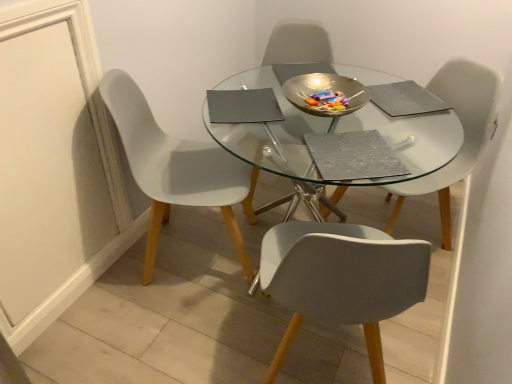
In order to face metallic silver chair at center, marked as the 2th chair in a left-to-right arrangement, should I rotate leftwards or rightwards?

To align with it, rotate right about 4.782°.

At what (x,y) coordinates should I click in order to perform the action: click on metallic silver chair at center, marked as the 2th chair in a left-to-right arrangement. Please return your answer as a coordinate pair (x, y). The width and height of the screenshot is (512, 384). Looking at the image, I should click on tap(298, 44).

This screenshot has width=512, height=384. I want to click on white plastic chair at left, positioned as the first chair in left-to-right order, so click(175, 168).

This screenshot has height=384, width=512. Find the location of `white plastic chair at center, which ranks as the third chair in left-to-right order`. white plastic chair at center, which ranks as the third chair in left-to-right order is located at coordinates (464, 136).

Identify the location of metallic silver chair at center, which is the second chair from right to left. (298, 44).

Would you say white plastic chair at left, positioned as the first chair in left-to-right order, is part of white plastic chair at center, which is the first chair in right-to-left order,'s contents?

No, white plastic chair at left, positioned as the first chair in left-to-right order, is not surrounded by white plastic chair at center, which is the first chair in right-to-left order.

Is white plastic chair at center, which is the first chair in right-to-left order, looking in the opposite direction of white plastic chair at left, placed as the 3th chair when sorted from right to left?

No, white plastic chair at center, which is the first chair in right-to-left order,'s orientation is not away from white plastic chair at left, placed as the 3th chair when sorted from right to left.

Visually, is white plastic chair at center, which is the first chair in right-to-left order, positioned to the left or to the right of white plastic chair at left, placed as the 3th chair when sorted from right to left?

white plastic chair at center, which is the first chair in right-to-left order, is to the right of white plastic chair at left, placed as the 3th chair when sorted from right to left.

From a real-world perspective, between white plastic chair at center, which ranks as the third chair in left-to-right order, and white plastic chair at left, placed as the 3th chair when sorted from right to left, who is vertically higher?

white plastic chair at left, placed as the 3th chair when sorted from right to left.

Which of these two, metallic silver chair at center, marked as the 2th chair in a left-to-right arrangement, or white plastic chair at left, placed as the 3th chair when sorted from right to left, is smaller?

metallic silver chair at center, marked as the 2th chair in a left-to-right arrangement.

From the image's perspective, between metallic silver chair at center, marked as the 2th chair in a left-to-right arrangement, and white plastic chair at left, placed as the 3th chair when sorted from right to left, which one is located above?

metallic silver chair at center, marked as the 2th chair in a left-to-right arrangement, from the image's perspective.

Does metallic silver chair at center, which is the second chair from right to left, have a greater height compared to white plastic chair at left, placed as the 3th chair when sorted from right to left?

In fact, metallic silver chair at center, which is the second chair from right to left, may be shorter than white plastic chair at left, placed as the 3th chair when sorted from right to left.

What's the angular difference between metallic silver chair at center, marked as the 2th chair in a left-to-right arrangement, and white plastic chair at left, positioned as the first chair in left-to-right order,'s facing directions?

There is a 92.5-degree angle between the facing directions of metallic silver chair at center, marked as the 2th chair in a left-to-right arrangement, and white plastic chair at left, positioned as the first chair in left-to-right order.

Based on the photo, between metallic silver chair at center, marked as the 2th chair in a left-to-right arrangement, and white plastic chair at center, which is the first chair in right-to-left order, which one has less height?

white plastic chair at center, which is the first chair in right-to-left order.

Looking at the image, does metallic silver chair at center, marked as the 2th chair in a left-to-right arrangement, seem bigger or smaller compared to white plastic chair at center, which is the first chair in right-to-left order?

Clearly, metallic silver chair at center, marked as the 2th chair in a left-to-right arrangement, is larger in size than white plastic chair at center, which is the first chair in right-to-left order.

Is metallic silver chair at center, which is the second chair from right to left, spatially inside white plastic chair at center, which ranks as the third chair in left-to-right order, or outside of it?

metallic silver chair at center, which is the second chair from right to left, is not inside white plastic chair at center, which ranks as the third chair in left-to-right order, it's outside.

Is metallic silver chair at center, marked as the 2th chair in a left-to-right arrangement, looking in the opposite direction of white plastic chair at center, which ranks as the third chair in left-to-right order?

metallic silver chair at center, marked as the 2th chair in a left-to-right arrangement, is not turned away from white plastic chair at center, which ranks as the third chair in left-to-right order.

From a real-world perspective, is white plastic chair at left, positioned as the first chair in left-to-right order, above or below metallic silver chair at center, which is the second chair from right to left?

In terms of real-world spatial position, white plastic chair at left, positioned as the first chair in left-to-right order, is below metallic silver chair at center, which is the second chair from right to left.

Is white plastic chair at left, positioned as the first chair in left-to-right order, turned away from metallic silver chair at center, marked as the 2th chair in a left-to-right arrangement?

No, white plastic chair at left, positioned as the first chair in left-to-right order, is not facing the opposite direction of metallic silver chair at center, marked as the 2th chair in a left-to-right arrangement.

Is white plastic chair at left, placed as the 3th chair when sorted from right to left, with metallic silver chair at center, which is the second chair from right to left?

They are not placed beside each other.

Based on the photo, considering the relative sizes of white plastic chair at left, positioned as the first chair in left-to-right order, and metallic silver chair at center, marked as the 2th chair in a left-to-right arrangement, in the image provided, is white plastic chair at left, positioned as the first chair in left-to-right order, shorter than metallic silver chair at center, marked as the 2th chair in a left-to-right arrangement,?

No.

Is white plastic chair at center, which ranks as the third chair in left-to-right order, wider or thinner than metallic silver chair at center, marked as the 2th chair in a left-to-right arrangement?

Clearly, white plastic chair at center, which ranks as the third chair in left-to-right order, has less width compared to metallic silver chair at center, marked as the 2th chair in a left-to-right arrangement.

Is white plastic chair at center, which ranks as the third chair in left-to-right order, further to camera compared to metallic silver chair at center, which is the second chair from right to left?

No, the depth of white plastic chair at center, which ranks as the third chair in left-to-right order, is less than that of metallic silver chair at center, which is the second chair from right to left.

From a real-world perspective, does white plastic chair at center, which is the first chair in right-to-left order, sit lower than metallic silver chair at center, which is the second chair from right to left?

Correct, in the physical world, white plastic chair at center, which is the first chair in right-to-left order, is lower than metallic silver chair at center, which is the second chair from right to left.

Measure the distance from white plastic chair at center, which ranks as the third chair in left-to-right order, to metallic silver chair at center, which is the second chair from right to left.

28.12 inches.

Considering the positions of objects white plastic chair at left, placed as the 3th chair when sorted from right to left, and white plastic chair at center, which is the first chair in right-to-left order, in the image provided, who is more to the left, white plastic chair at left, placed as the 3th chair when sorted from right to left, or white plastic chair at center, which is the first chair in right-to-left order,?

white plastic chair at left, placed as the 3th chair when sorted from right to left, is more to the left.

Is white plastic chair at center, which ranks as the third chair in left-to-right order, at the back of white plastic chair at left, positioned as the first chair in left-to-right order?

white plastic chair at left, positioned as the first chair in left-to-right order, is not turned away from white plastic chair at center, which ranks as the third chair in left-to-right order.

What's the angular difference between white plastic chair at left, positioned as the first chair in left-to-right order, and white plastic chair at center, which is the first chair in right-to-left order,'s facing directions?

There is a 154-degree angle between the facing directions of white plastic chair at left, positioned as the first chair in left-to-right order, and white plastic chair at center, which is the first chair in right-to-left order.

Are white plastic chair at left, placed as the 3th chair when sorted from right to left, and white plastic chair at center, which is the first chair in right-to-left order, beside each other?

white plastic chair at left, placed as the 3th chair when sorted from right to left, and white plastic chair at center, which is the first chair in right-to-left order, are not in contact.

Locate an element on the screen. the 1st chair above when counting from the white plastic chair at left, placed as the 3th chair when sorted from right to left (from the image's perspective) is located at coordinates (464, 136).

From the image's perspective, count 2nd chairs downward from the metallic silver chair at center, marked as the 2th chair in a left-to-right arrangement, and point to it. Please provide its 2D coordinates.

[(175, 168)]

Which object lies nearer to the anchor point metallic silver chair at center, which is the second chair from right to left, white plastic chair at center, which ranks as the third chair in left-to-right order, or white plastic chair at left, placed as the 3th chair when sorted from right to left?

white plastic chair at left, placed as the 3th chair when sorted from right to left.

From the image, which object appears to be farther from white plastic chair at left, positioned as the first chair in left-to-right order, white plastic chair at center, which is the first chair in right-to-left order, or metallic silver chair at center, marked as the 2th chair in a left-to-right arrangement?

Based on the image, white plastic chair at center, which is the first chair in right-to-left order, appears to be further to white plastic chair at left, positioned as the first chair in left-to-right order.

Based on their spatial positions, is white plastic chair at left, placed as the 3th chair when sorted from right to left, or metallic silver chair at center, which is the second chair from right to left, closer to white plastic chair at center, which ranks as the third chair in left-to-right order?

metallic silver chair at center, which is the second chair from right to left, lies closer to white plastic chair at center, which ranks as the third chair in left-to-right order, than the other object.

Based on their spatial positions, is white plastic chair at left, placed as the 3th chair when sorted from right to left, or white plastic chair at center, which ranks as the third chair in left-to-right order, further from metallic silver chair at center, marked as the 2th chair in a left-to-right arrangement?

white plastic chair at center, which ranks as the third chair in left-to-right order, is further to metallic silver chair at center, marked as the 2th chair in a left-to-right arrangement.

Which object lies further to the anchor point white plastic chair at center, which is the first chair in right-to-left order, metallic silver chair at center, marked as the 2th chair in a left-to-right arrangement, or white plastic chair at left, placed as the 3th chair when sorted from right to left?

white plastic chair at left, placed as the 3th chair when sorted from right to left, is further to white plastic chair at center, which is the first chair in right-to-left order.

From the image, which object appears to be farther from white plastic chair at left, placed as the 3th chair when sorted from right to left, metallic silver chair at center, marked as the 2th chair in a left-to-right arrangement, or white plastic chair at center, which is the first chair in right-to-left order?

Based on the image, white plastic chair at center, which is the first chair in right-to-left order, appears to be further to white plastic chair at left, placed as the 3th chair when sorted from right to left.

You are a GUI agent. You are given a task and a screenshot of the screen. Output one action in this format:
    pyautogui.click(x=<x>, y=<y>)
    Task: Click on the chair between white plastic chair at left, positioned as the first chair in left-to-right order, and white plastic chair at center, which is the first chair in right-to-left order, in the horizontal direction
    
    Given the screenshot: What is the action you would take?
    pyautogui.click(x=298, y=44)